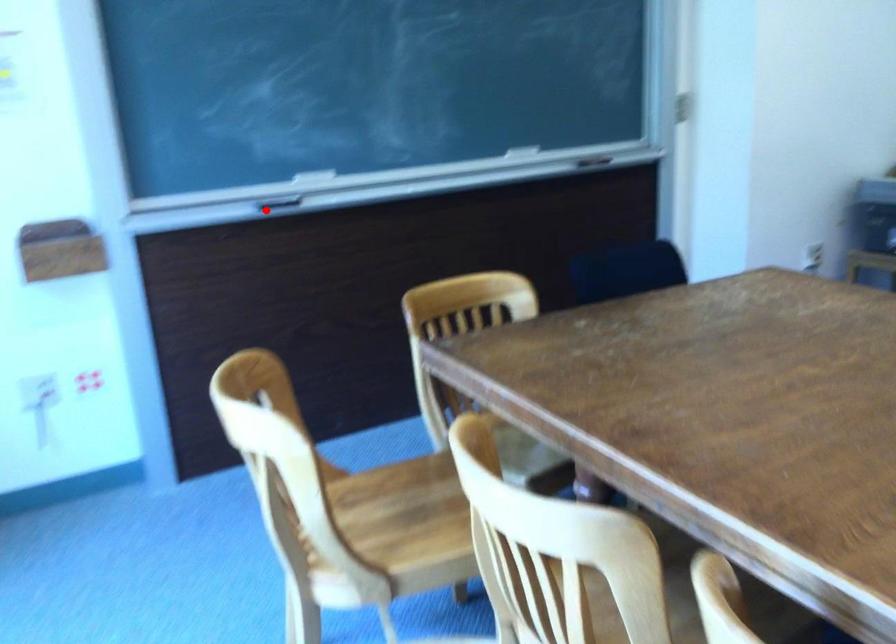
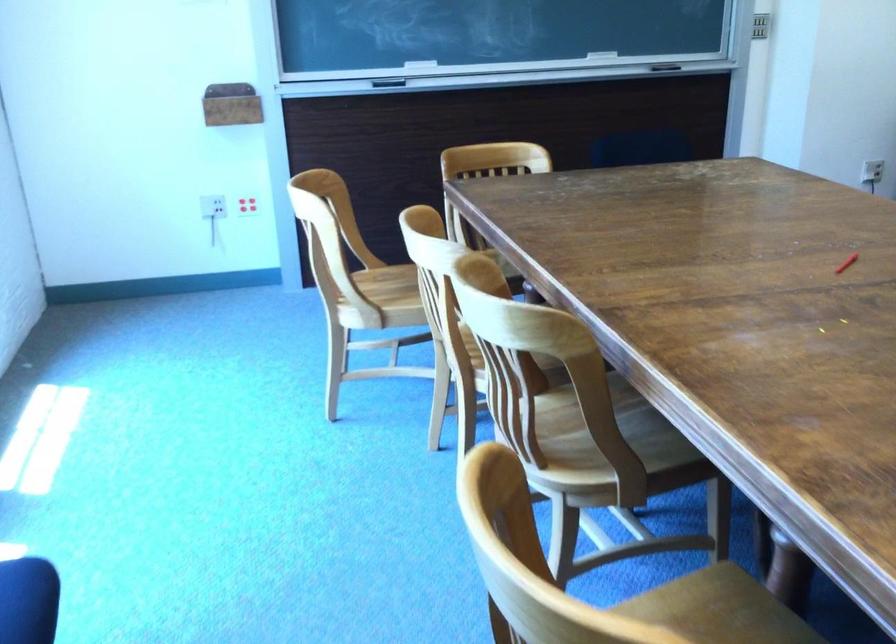
Question: I am providing you with two images of the same scene from different viewpoints. Given a red point in image1, look at the same physical point in image2. Is it:

Choices:
 (A) Closer to the viewpoint
 (B) Farther from the viewpoint

Answer: (B)